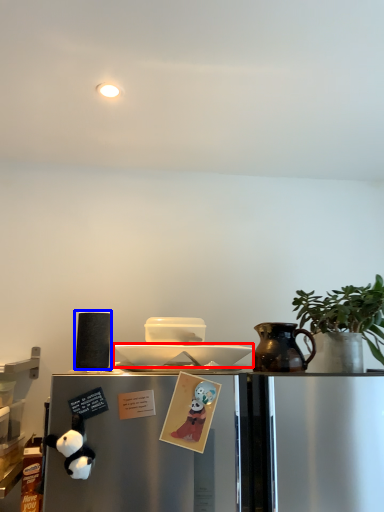
Question: Which of the following is the farthest to the observer, plate (highlighted by a red box) or appliance (highlighted by a blue box)?

Choices:
 (A) plate
 (B) appliance

Answer: (B)